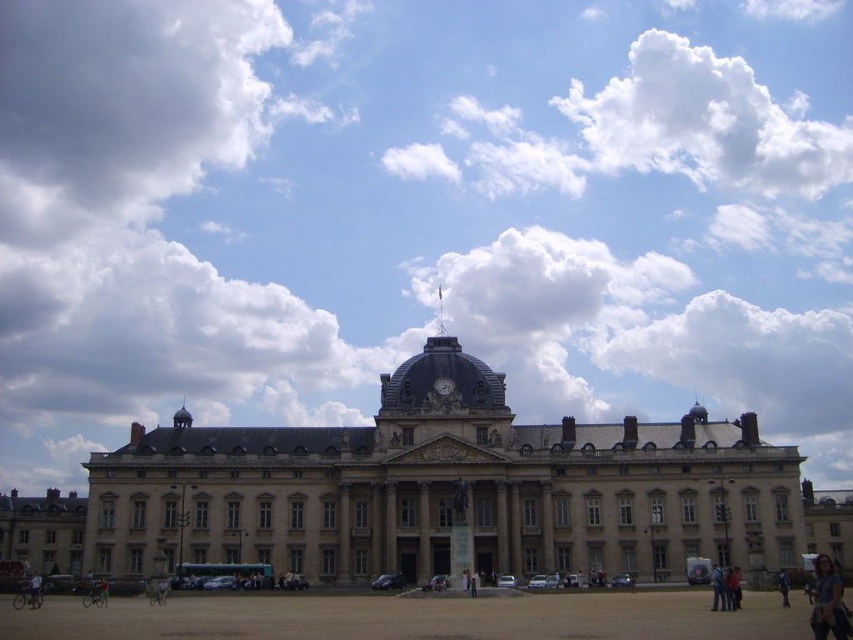
This screenshot has width=853, height=640. What do you see at coordinates (828, 602) in the screenshot? I see `blue denim jeans at lower right` at bounding box center [828, 602].

Can you confirm if blue denim jeans at lower right is shorter than light blue denim jeans at lower left?

No.

At what (x,y) coordinates should I click in order to perform the action: click on blue denim jeans at lower right. Please return your answer as a coordinate pair (x, y). The height and width of the screenshot is (640, 853). Looking at the image, I should click on (828, 602).

Which of these two, blue fabric person at lower right or matte gray clock at center, stands taller?

Standing taller between the two is blue fabric person at lower right.

This screenshot has height=640, width=853. What are the coordinates of `blue fabric person at lower right` in the screenshot? It's located at (782, 588).

Is light blue denim jeans at lower left wider than blue fabric person at lower right?

Yes, light blue denim jeans at lower left is wider than blue fabric person at lower right.

Who is more forward, (32, 602) or (779, 579)?

Positioned in front is point (32, 602).

This screenshot has width=853, height=640. Find the location of `light blue denim jeans at lower left`. light blue denim jeans at lower left is located at coordinates (35, 589).